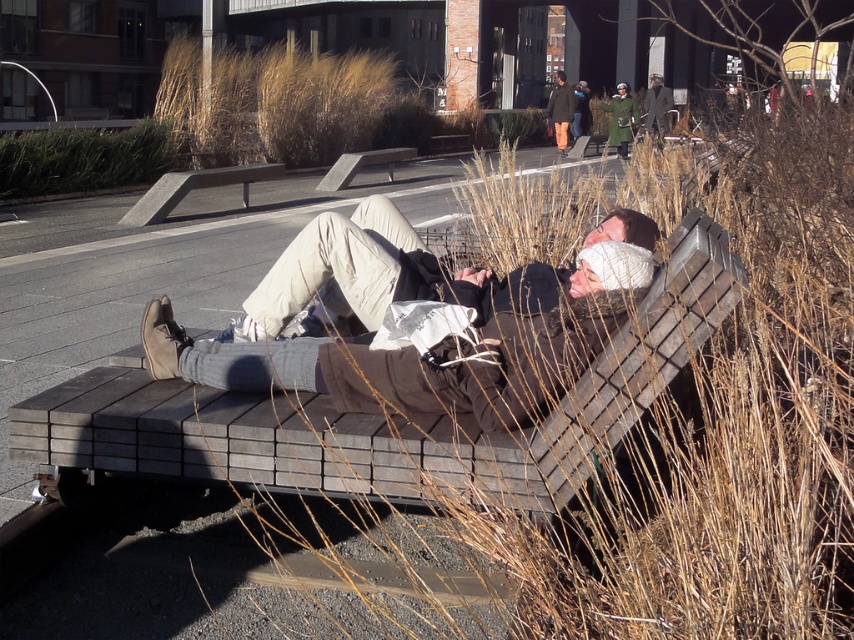
You are standing at the point marked by the coordinates point (379, 416) in the park scene. What object are you standing on?

The point (379, 416) marks the wooden bench at center, so you are standing on the wooden bench at center.

You are a photographer standing in the park and want to take a photo of the wooden park bench at center and the dark brown leather coat at upper center. Since you want both objects to be clearly visible in the photo, which object should you focus on first to ensure it appears sharp?

The wooden park bench at center is in front of the dark brown leather coat at upper center. To ensure both are sharp, focus on the wooden park bench at center first since it is closer to the camera.